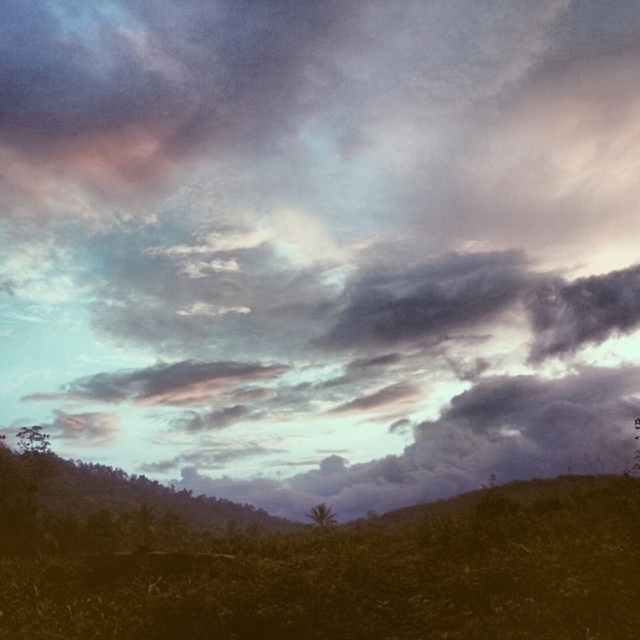
Question: Among these objects, which one is farthest from the camera?

Choices:
 (A) green grassy field at lower center
 (B) green leafy tree at lower left

Answer: (B)

Question: Which point is farther from the camera taking this photo?

Choices:
 (A) (49, 445)
 (B) (620, 570)

Answer: (A)

Question: Observing the image, what is the correct spatial positioning of green grassy field at lower center in reference to green leafy tree at center?

Choices:
 (A) right
 (B) left

Answer: (B)

Question: Among these points, which one is nearest to the camera?

Choices:
 (A) (35, 426)
 (B) (369, 547)
 (C) (314, 516)

Answer: (B)

Question: Does green leafy tree at lower left have a smaller size compared to green leafy tree at center?

Choices:
 (A) yes
 (B) no

Answer: (A)

Question: Is the position of green leafy tree at lower left less distant than that of green leafy tree at center?

Choices:
 (A) no
 (B) yes

Answer: (A)